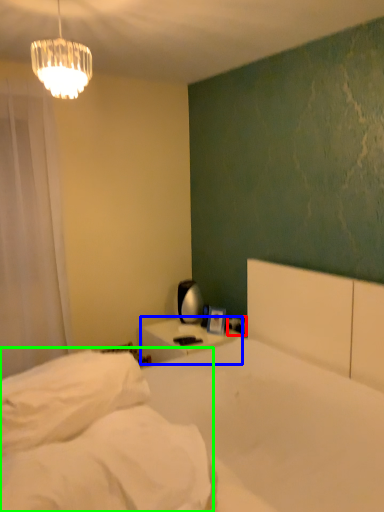
Question: Which object is the closest to the electric outlet (highlighted by a red box)? Choose among these: nightstand (highlighted by a blue box) or mattress (highlighted by a green box).

Choices:
 (A) nightstand
 (B) mattress

Answer: (A)